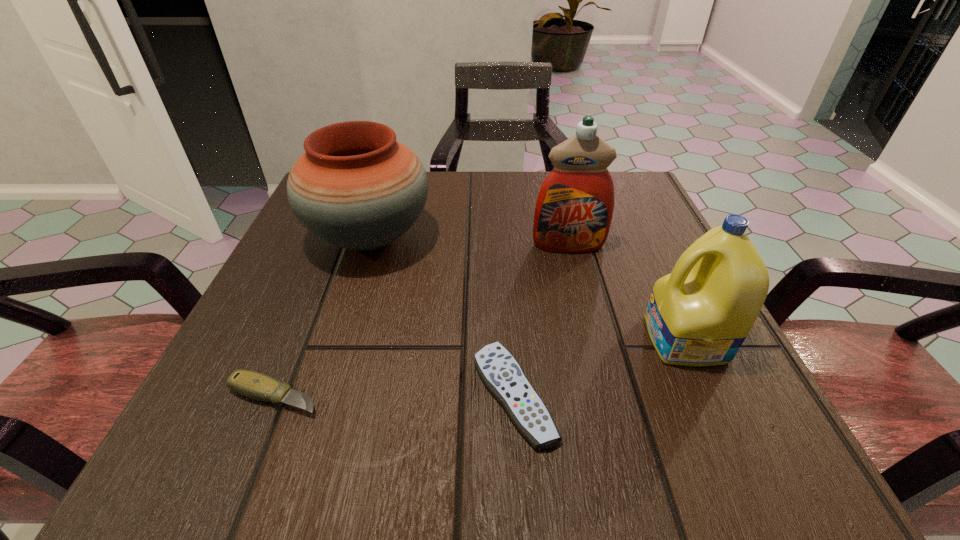
Locate an element on the screen. This screenshot has height=540, width=960. vacant space that's between the shortest object and the farther detergent is located at coordinates (541, 320).

The width and height of the screenshot is (960, 540). Identify the location of the second closest object to the shortest object. (356, 187).

Find the location of `object that stands as the second closest to the pottery`. object that stands as the second closest to the pottery is located at coordinates pos(574,208).

Identify the location of free space in the image that satisfies the following two spatial constraints: 1. on the back side of the pottery; 2. on the right side of the fourth tallest object. (339, 238).

Identify the location of free space that satisfies the following two spatial constraints: 1. on the back side of the fourth tallest object; 2. on the right side of the pottery. (339, 238).